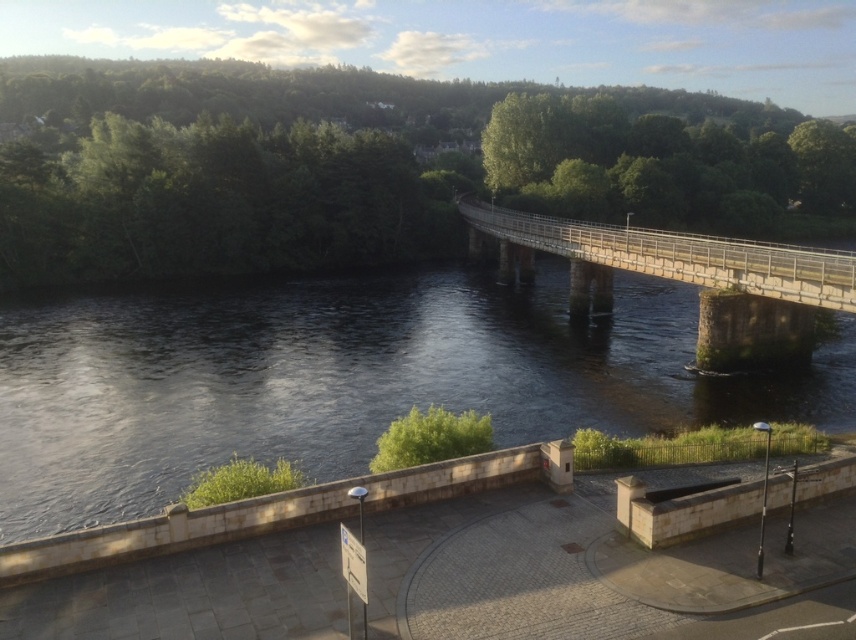
Can you confirm if dark water at center is positioned to the right of stone bridge at center?

In fact, dark water at center is to the left of stone bridge at center.

Can you confirm if dark water at center is wider than stone bridge at center?

Yes, dark water at center is wider than stone bridge at center.

In order to click on dark water at center in this screenshot , I will do `click(345, 378)`.